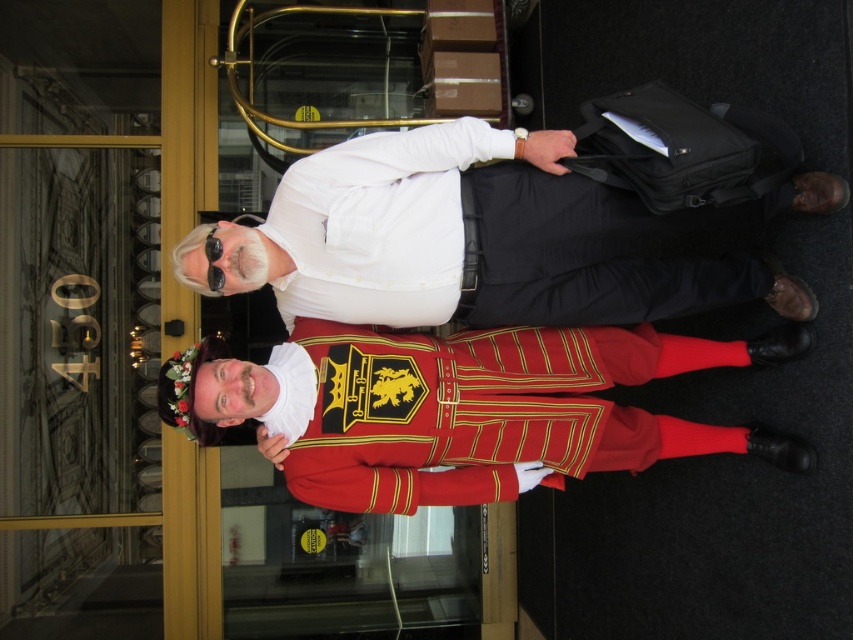
Who is more distant from viewer, (x=693, y=276) or (x=376, y=353)?

Positioned behind is point (x=693, y=276).

Find the location of a particular element. The width and height of the screenshot is (853, 640). white matte shirt at upper center is located at coordinates (485, 237).